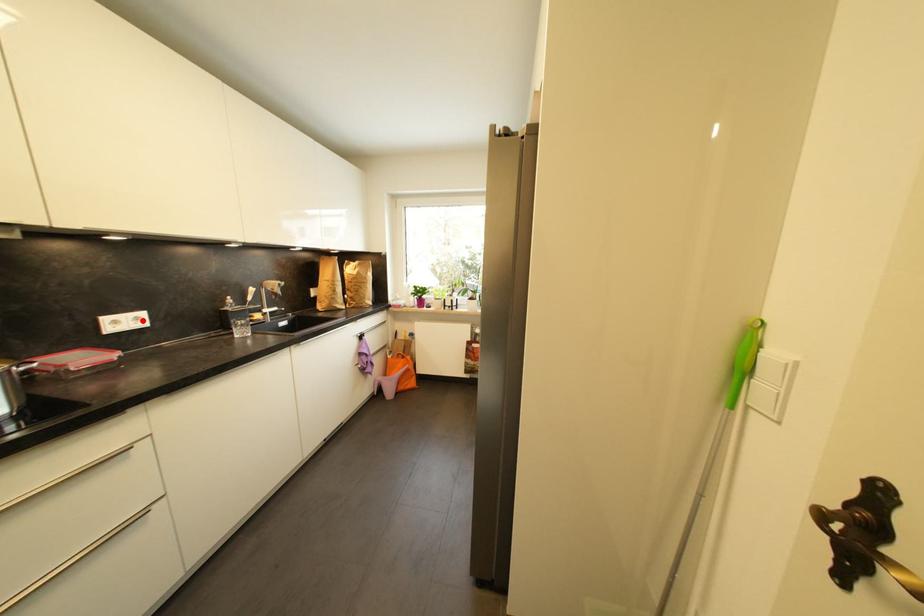
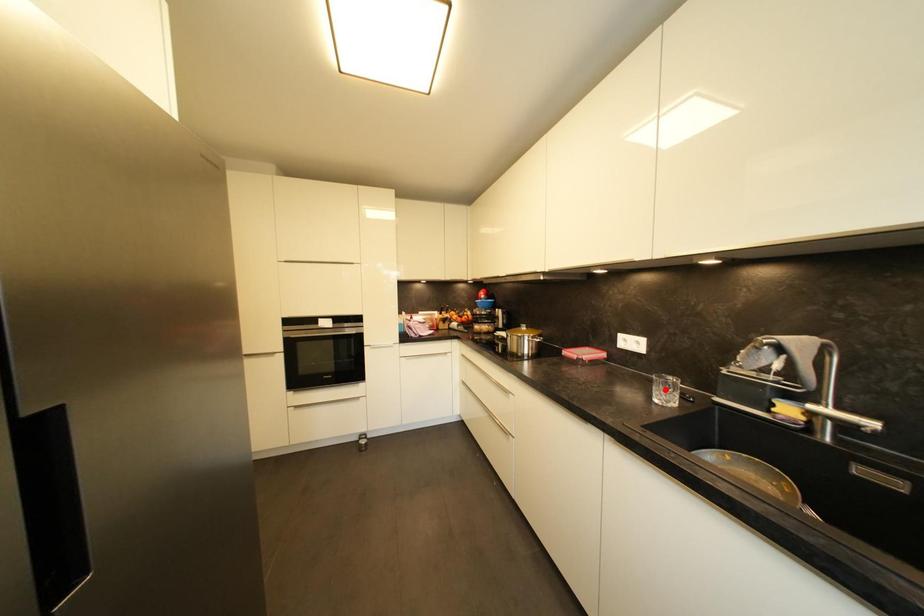
I am providing you with two images of the same scene from different viewpoints. A red point is marked on the first image and another point is marked on the second image. Is the red point in image1 aligned with the point shown in image2?

No